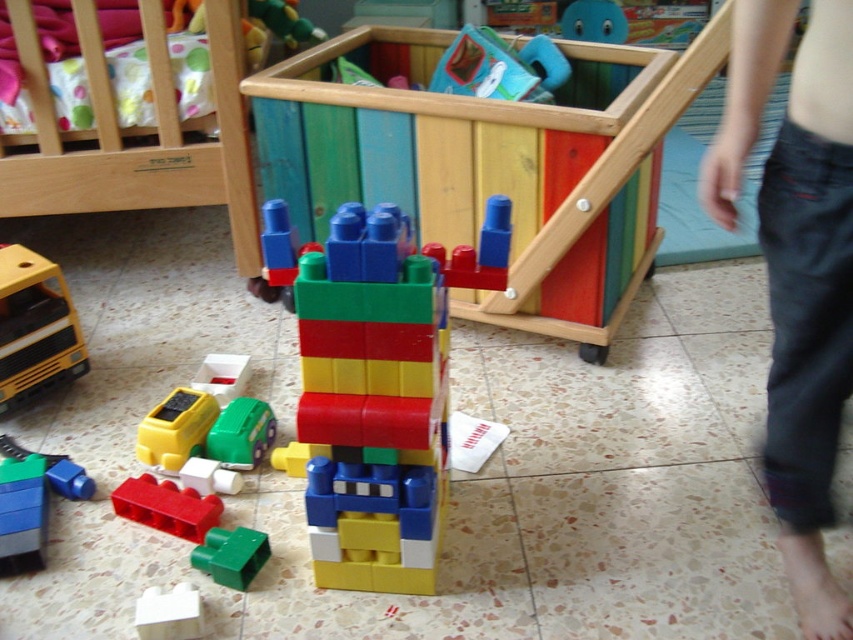
Question: Among these points, which one is nearest to the camera?

Choices:
 (A) (338, 493)
 (B) (517, 316)
 (C) (228, 412)
 (D) (198, 385)

Answer: (A)

Question: From the image, what is the correct spatial relationship of green matte car at lower left in relation to smooth plastic car at lower left?

Choices:
 (A) below
 (B) above

Answer: (A)

Question: Is green matte block at center below white matte plastic at lower left?

Choices:
 (A) yes
 (B) no

Answer: (B)

Question: Which object is positioned farthest from the yellow plastic toy truck at left?

Choices:
 (A) rubberized red brick at lower left
 (B) wooden toy box at center
 (C) yellow matte plastic toy car at lower left

Answer: (B)

Question: Is rubberized red brick at lower left in front of green matte car at lower left?

Choices:
 (A) yes
 (B) no

Answer: (A)

Question: Which is farther from the wooden toy box at center?

Choices:
 (A) green matte car at lower left
 (B) yellow plastic toy truck at left
 (C) white matte plastic at lower left

Answer: (C)